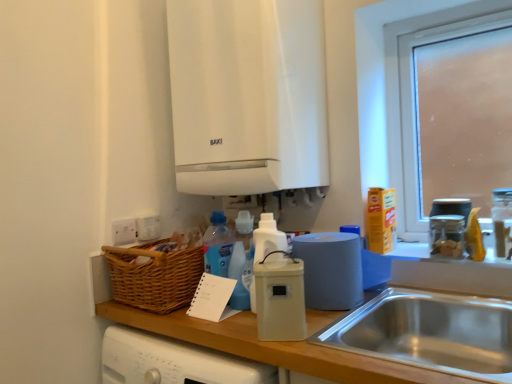
Question: Can you confirm if white plastic bottle at center, acting as the 2th bottle starting from the right, is shorter than frosted glass window at upper right?

Choices:
 (A) no
 (B) yes

Answer: (B)

Question: Can you see white plastic bottle at center, acting as the 2th bottle starting from the right, touching frosted glass window at upper right?

Choices:
 (A) no
 (B) yes

Answer: (A)

Question: Is white plastic bottle at center, acting as the 1th bottle starting from the left, outside of frosted glass window at upper right?

Choices:
 (A) no
 (B) yes

Answer: (B)

Question: Can you confirm if white plastic bottle at center, acting as the 1th bottle starting from the left, is positioned to the left of frosted glass window at upper right?

Choices:
 (A) yes
 (B) no

Answer: (A)

Question: Is white plastic bottle at center, acting as the 1th bottle starting from the left, positioned far away from frosted glass window at upper right?

Choices:
 (A) yes
 (B) no

Answer: (B)

Question: Is point (263, 215) closer or farther from the camera than point (485, 244)?

Choices:
 (A) closer
 (B) farther

Answer: (A)

Question: From a real-world perspective, is white plastic bottle at center, acting as the 1th bottle starting from the left, above or below blue matte paper towel roll at right?

Choices:
 (A) below
 (B) above

Answer: (B)

Question: Would you say white plastic bottle at center, acting as the 1th bottle starting from the left, is to the left or to the right of blue matte paper towel roll at right in the picture?

Choices:
 (A) right
 (B) left

Answer: (B)

Question: From the image's perspective, is white plastic bottle at center, acting as the 1th bottle starting from the left, located above or below blue matte paper towel roll at right?

Choices:
 (A) below
 (B) above

Answer: (B)

Question: Does point (183, 162) appear closer or farther from the camera than point (352, 238)?

Choices:
 (A) farther
 (B) closer

Answer: (A)

Question: Is white matte boiler at upper center spatially inside matte plastic roll of paper towels at center, the second kitchen appliance positioned from the front, or outside of it?

Choices:
 (A) outside
 (B) inside

Answer: (A)

Question: Would you say white matte boiler at upper center is to the left or to the right of matte plastic roll of paper towels at center, the second kitchen appliance positioned from the front, in the picture?

Choices:
 (A) right
 (B) left

Answer: (B)

Question: From a real-world perspective, relative to matte plastic roll of paper towels at center, arranged as the first kitchen appliance when viewed from the back, is white matte boiler at upper center vertically above or below?

Choices:
 (A) above
 (B) below

Answer: (A)

Question: Is point (263, 66) closer or farther from the camera than point (391, 38)?

Choices:
 (A) closer
 (B) farther

Answer: (A)

Question: Is white matte boiler at upper center taller or shorter than frosted glass window at upper right?

Choices:
 (A) short
 (B) tall

Answer: (B)